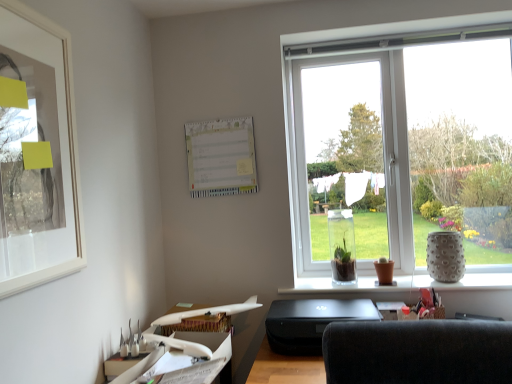
Measure the distance between white plastic airplane at lower left and camera.

white plastic airplane at lower left is 3.89 feet from camera.

Measure the distance between clear glass vase at center and camera.

clear glass vase at center and camera are 1.85 meters apart from each other.

Find the location of a particular element. This screenshot has width=512, height=384. black matte printer at lower center is located at coordinates (311, 322).

Describe the element at coordinates (445, 256) in the screenshot. The width and height of the screenshot is (512, 384). I see `speckled ceramic vase at right` at that location.

What is the approximate height of white paper calendar at upper center?

The height of white paper calendar at upper center is 14.52 inches.

Where is `white plastic airplane at lower left`? Image resolution: width=512 pixels, height=384 pixels. white plastic airplane at lower left is located at coordinates (187, 348).

From a real-world perspective, relative to white plastic airplane at lower left, is white matte picture frame at upper left vertically above or below?

In terms of real-world spatial position, white matte picture frame at upper left is above white plastic airplane at lower left.

Considering the sizes of white matte picture frame at upper left and white plastic airplane at lower left in the image, is white matte picture frame at upper left wider or thinner than white plastic airplane at lower left?

In the image, white matte picture frame at upper left appears to be more narrow than white plastic airplane at lower left.

Is point (16, 285) behind point (203, 312)?

No.

How much distance is there between speckled ceramic vase at right and clear glass vase at center?

speckled ceramic vase at right and clear glass vase at center are 15.29 centimeters apart from each other.

From the image's perspective, is speckled ceramic vase at right located above or below clear glass vase at center?

Clearly, from the image's perspective, speckled ceramic vase at right is above clear glass vase at center.

Is speckled ceramic vase at right situated inside clear glass vase at center or outside?

speckled ceramic vase at right is located beyond the bounds of clear glass vase at center.

Does speckled ceramic vase at right appear on the right side of clear glass vase at center?

Indeed, speckled ceramic vase at right is positioned on the right side of clear glass vase at center.

From the picture: From the image's perspective, who appears lower, white plastic airplane at lower left or white matte picture frame at upper left?

white plastic airplane at lower left.

Identify the location of computer desk behind the white matte picture frame at upper left. The image size is (512, 384). (187, 348).

Is white matte picture frame at upper left completely or partially inside white plastic airplane at lower left?

No, white matte picture frame at upper left is not surrounded by white plastic airplane at lower left.

Is white plastic airplane at lower left in front of or behind white matte picture frame at upper left in the image?

In the image, white plastic airplane at lower left appears behind white matte picture frame at upper left.

Is white matte picture frame at upper left not within clear glass vase at center?

Absolutely, white matte picture frame at upper left is external to clear glass vase at center.

Is white matte picture frame at upper left oriented towards clear glass vase at center?

No, white matte picture frame at upper left is not aimed at clear glass vase at center.

Considering the sizes of objects white matte picture frame at upper left and clear glass vase at center in the image provided, who is wider, white matte picture frame at upper left or clear glass vase at center?

Wider between the two is clear glass vase at center.

Is white matte picture frame at upper left touching clear glass vase at center?

white matte picture frame at upper left and clear glass vase at center are not in contact.

Which object is positioned more to the right, white paper calendar at upper center or clear glass vase at center?

From the viewer's perspective, clear glass vase at center appears more on the right side.

You are a GUI agent. You are given a task and a screenshot of the screen. Output one action in this format:
    pyautogui.click(x=<x>, y=<y>)
    Task: Click on the bulletin board above the clear glass vase at center (from a real-world perspective)
    This screenshot has height=384, width=512.
    Given the screenshot: What is the action you would take?
    pyautogui.click(x=221, y=157)

From the image's perspective, is white paper calendar at upper center located above or below clear glass vase at center?

From the image's perspective, white paper calendar at upper center appears above clear glass vase at center.

Measure the distance from white paper calendar at upper center to clear glass vase at center.

They are 28.18 inches apart.

Is white paper calendar at upper center completely or partially outside of white plastic airplane at lower left?

Indeed, white paper calendar at upper center is completely outside white plastic airplane at lower left.

Which of these two, white paper calendar at upper center or white plastic airplane at lower left, is smaller?

Smaller between the two is white paper calendar at upper center.

From a real-world perspective, which object rests below the other?

In real-world perspective, white plastic airplane at lower left is lower.

From the image's perspective, between black matte printer at lower center and white matte picture frame at upper left, who is located below?

black matte printer at lower center, from the image's perspective.

Who is bigger, black matte printer at lower center or white matte picture frame at upper left?

With larger size is black matte printer at lower center.

How distant is black matte printer at lower center from white matte picture frame at upper left?

A distance of 3.47 feet exists between black matte printer at lower center and white matte picture frame at upper left.

Could white matte picture frame at upper left be considered to be inside black matte printer at lower center?

No.

Where is `computer desk located on the right of white matte picture frame at upper left`? computer desk located on the right of white matte picture frame at upper left is located at coordinates (187, 348).

In the image, there is a speckled ceramic vase at right. Where is `window sill below it (from the image's perspective)`? This screenshot has height=384, width=512. window sill below it (from the image's perspective) is located at coordinates (401, 284).

From the picture: From the image, which object appears to be nearer to speckled ceramic vase at right, white matte picture frame at upper left or white plastic airplane at lower left?

white plastic airplane at lower left is positioned closer to the anchor speckled ceramic vase at right.

Based on their spatial positions, is white paper calendar at upper center or white plastic airplane at lower left further from white matte picture frame at upper left?

The object further to white matte picture frame at upper left is white paper calendar at upper center.

Looking at the image, which one is located closer to white paper calendar at upper center, white plastic airplane at lower left or speckled ceramic vase at right?

white plastic airplane at lower left lies closer to white paper calendar at upper center than the other object.

From the image, which object appears to be nearer to black matte printer at lower center, white paper calendar at upper center or white plastic airplane at lower left?

white plastic airplane at lower left lies closer to black matte printer at lower center than the other object.

Based on their spatial positions, is white plastic airplane at lower left or black matte printer at lower center further from clear glass vase at center?

Based on the image, white plastic airplane at lower left appears to be further to clear glass vase at center.

Looking at the image, which one is located further to white plastic airplane at lower left, clear glass vase at center or black matte printer at lower center?

clear glass vase at center.

Which object lies further to the anchor point speckled ceramic vase at right, clear glass vase at center or white plastic airplane at lower left?

white plastic airplane at lower left.

Considering their positions, is clear glass vase at center positioned further to white paper calendar at upper center than white plastic airplane at lower left?

Among the two, clear glass vase at center is located further to white paper calendar at upper center.

In order to click on computer desk between white matte picture frame at upper left and white paper calendar at upper center in the front-back direction in this screenshot , I will do `click(187, 348)`.

This screenshot has height=384, width=512. Find the location of `bulletin board situated between white matte picture frame at upper left and speckled ceramic vase at right from left to right`. bulletin board situated between white matte picture frame at upper left and speckled ceramic vase at right from left to right is located at coordinates (221, 157).

Where is `computer desk between white matte picture frame at upper left and speckled ceramic vase at right`? This screenshot has height=384, width=512. computer desk between white matte picture frame at upper left and speckled ceramic vase at right is located at coordinates (187, 348).

Locate an element on the screen. window sill located between black matte printer at lower center and speckled ceramic vase at right in the left-right direction is located at coordinates (401, 284).